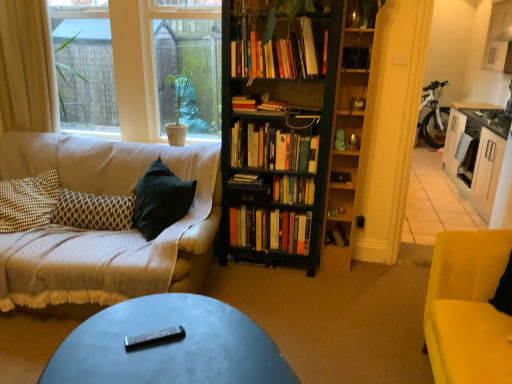
Find the location of a particular element. The image size is (512, 384). unoccupied region to the right of black wooden bookcase at center is located at coordinates (359, 278).